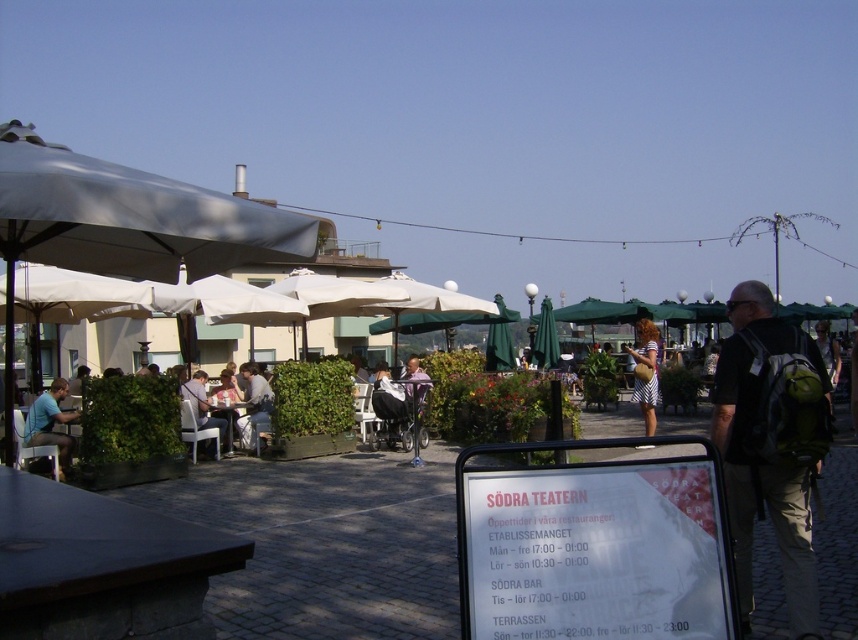
You are a customer at the outdoor seating area of S?dra Teatern. You see a dark green backpack at right and a matte black shirt at lower left. Which object is closer to you?

The dark green backpack at right is closer to you because it is in front of the matte black shirt at lower left.

You are a photographer trying to capture a photo of the matte black shirt at lower left and the striped dress at center. Since you want both subjects to be clearly visible in the frame, which subject should you focus on first to ensure proper exposure, considering their sizes in the image?

The matte black shirt at lower left has a lesser height compared to striped dress at center, so you should focus on the striped dress at center first because it is larger and might require more precise exposure settings.